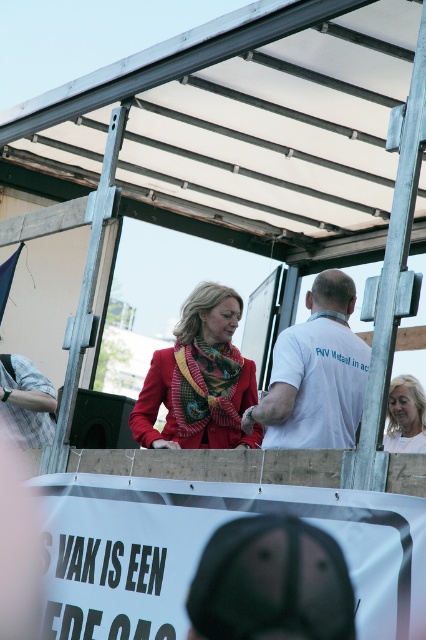
Where is `white cotton t-shirt at center`? The image size is (426, 640). white cotton t-shirt at center is located at coordinates (316, 374).

Is point (255, 412) in front of point (196, 388)?

Yes, it is.

The height and width of the screenshot is (640, 426). I want to click on white cotton t-shirt at center, so click(x=316, y=374).

You are a GUI agent. You are given a task and a screenshot of the screen. Output one action in this format:
    pyautogui.click(x=<x>, y=<y>)
    Task: Click on the matte red coat at center
    The width and height of the screenshot is (426, 640).
    Given the screenshot: What is the action you would take?
    pyautogui.click(x=199, y=380)

Measure the distance between point (x=196, y=387) and camera.

Point (x=196, y=387) and camera are 28.55 feet apart from each other.

Image resolution: width=426 pixels, height=640 pixels. In order to click on matte red coat at center in this screenshot , I will do `click(199, 380)`.

Which is more to the right, metallic silver canopy at upper center or multicolored patterned scarf at center?

multicolored patterned scarf at center

Is metallic silver canopy at upper center closer to camera compared to multicolored patterned scarf at center?

Yes, it is in front of multicolored patterned scarf at center.

Is point (342, 186) positioned in front of point (199, 417)?

No, it is not.

The image size is (426, 640). In order to click on metallic silver canopy at upper center in this screenshot , I will do `click(244, 128)`.